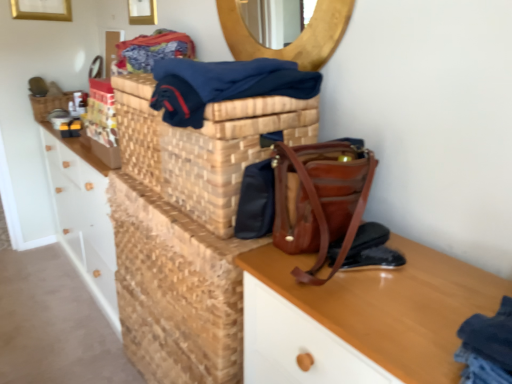
Identify the location of free region on the left part of leather at center, the 1th shoe in the top-to-bottom sequence. (288, 268).